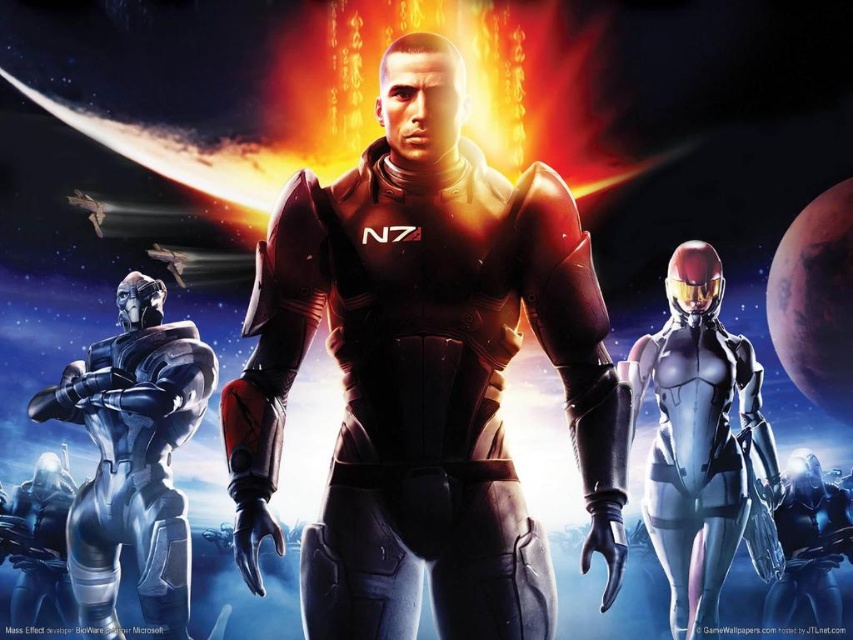
Question: Estimate the real-world distances between objects in this image. Which object is farther from the shiny silver armor at left?

Choices:
 (A) shiny metallic armor at center
 (B) metallic silver armor at right

Answer: (A)

Question: Which of the following is the closest to the observer?

Choices:
 (A) (38, 412)
 (B) (315, 216)
 (C) (741, 502)

Answer: (B)

Question: Is shiny metallic armor at center below metallic silver armor at right?

Choices:
 (A) yes
 (B) no

Answer: (B)

Question: Can you confirm if shiny metallic armor at center is wider than metallic silver armor at right?

Choices:
 (A) no
 (B) yes

Answer: (A)

Question: Is shiny metallic armor at center thinner than shiny silver armor at left?

Choices:
 (A) no
 (B) yes

Answer: (B)

Question: Based on their relative distances, which object is farther from the shiny metallic armor at center?

Choices:
 (A) shiny silver armor at left
 (B) metallic silver armor at right

Answer: (A)